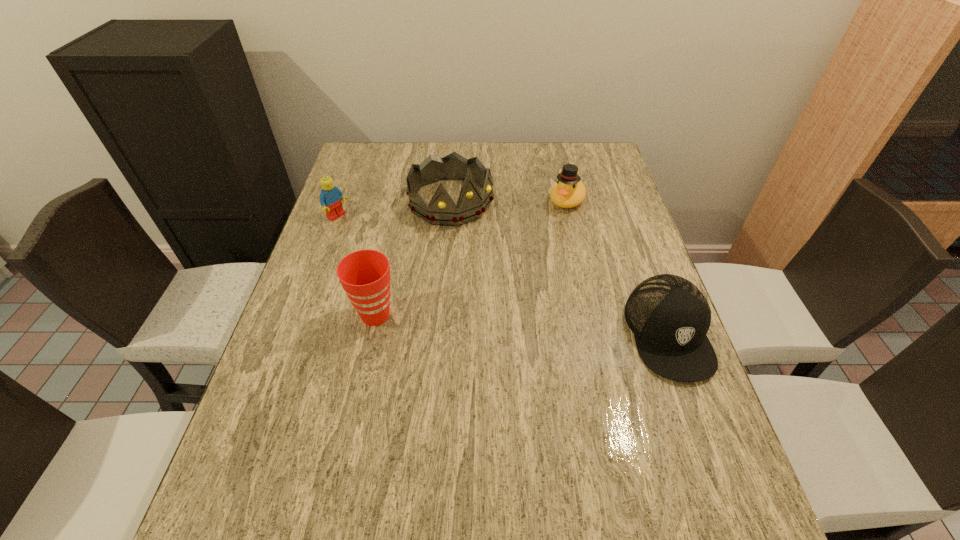
Where is `cup`? cup is located at coordinates pos(365,274).

Find the location of a particular element. the rightmost object is located at coordinates (669, 316).

At what (x,y) coordinates should I click in order to perform the action: click on tiara. Please return your answer as a coordinate pair (x, y). The image size is (960, 540). Looking at the image, I should click on (441, 210).

Where is `the leftmost object`? Image resolution: width=960 pixels, height=540 pixels. the leftmost object is located at coordinates 330,198.

At what (x,y) coordinates should I click in order to perform the action: click on the second object from right to left. Please return your answer as a coordinate pair (x, y). This screenshot has height=540, width=960. Looking at the image, I should click on (569, 191).

Where is `free space located on the back of the second tallest object`? The image size is (960, 540). free space located on the back of the second tallest object is located at coordinates (388, 258).

Where is `vacant region located on the front-facing side of the cap`? vacant region located on the front-facing side of the cap is located at coordinates (720, 475).

Locate an element on the screen. This screenshot has width=960, height=540. vacant region located at the front of the tiara with jewels is located at coordinates (539, 300).

I want to click on free location located 0.190m at the front of the tiara with jewels, so click(x=508, y=265).

The image size is (960, 540). Find the location of `free space located 0.330m at the front of the tiara with jewels`. free space located 0.330m at the front of the tiara with jewels is located at coordinates (539, 300).